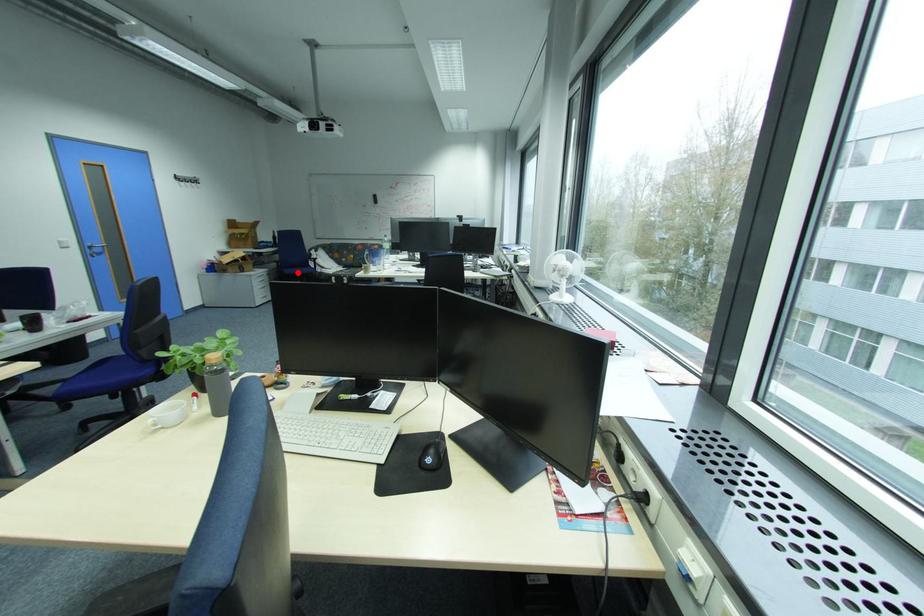
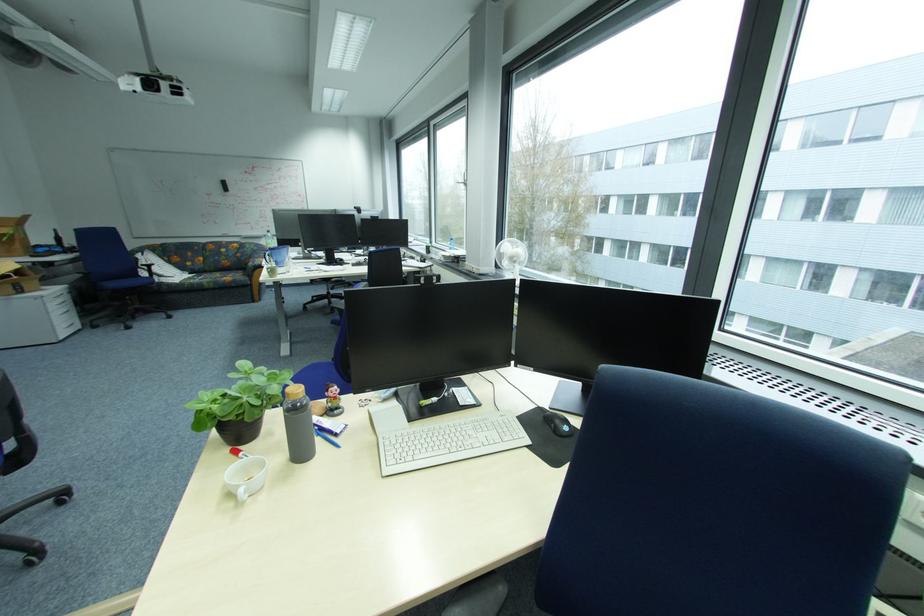
In the second image, find the point that corresponds to the highlighted location in the first image.

(120, 286)